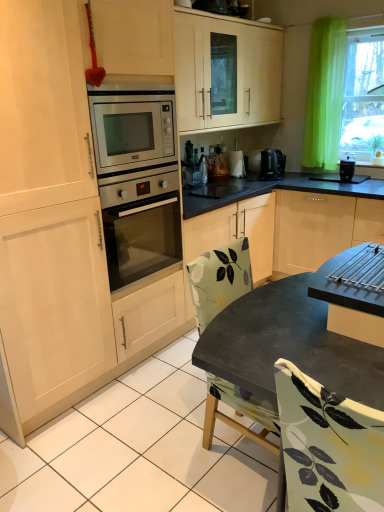
Question: Is metallic silver coffee maker at upper right positioned with its back to satin silver oven at center?

Choices:
 (A) no
 (B) yes

Answer: (A)

Question: Is metallic silver coffee maker at upper right in front of satin silver oven at center?

Choices:
 (A) no
 (B) yes

Answer: (A)

Question: Would you say metallic silver coffee maker at upper right contains satin silver oven at center?

Choices:
 (A) no
 (B) yes

Answer: (A)

Question: From a real-world perspective, is metallic silver coffee maker at upper right physically below satin silver oven at center?

Choices:
 (A) no
 (B) yes

Answer: (A)

Question: From a real-world perspective, is metallic silver coffee maker at upper right on top of satin silver oven at center?

Choices:
 (A) yes
 (B) no

Answer: (A)

Question: Is metallic silver coffee maker at upper right outside satin silver oven at center?

Choices:
 (A) yes
 (B) no

Answer: (A)

Question: Can you confirm if matte black table at center is wider than black plastic coffee maker at right?

Choices:
 (A) no
 (B) yes

Answer: (B)

Question: From the image's perspective, is matte black table at center under black plastic coffee maker at right?

Choices:
 (A) yes
 (B) no

Answer: (A)

Question: Can you confirm if matte black table at center is bigger than black plastic coffee maker at right?

Choices:
 (A) no
 (B) yes

Answer: (B)

Question: Does matte black table at center have a lesser height compared to black plastic coffee maker at right?

Choices:
 (A) yes
 (B) no

Answer: (B)

Question: Would you say matte black table at center contains black plastic coffee maker at right?

Choices:
 (A) no
 (B) yes

Answer: (A)

Question: Is matte black table at center thinner than black plastic coffee maker at right?

Choices:
 (A) no
 (B) yes

Answer: (A)

Question: Is matte black table at center completely or partially inside metallic silver coffee maker at upper right?

Choices:
 (A) no
 (B) yes

Answer: (A)